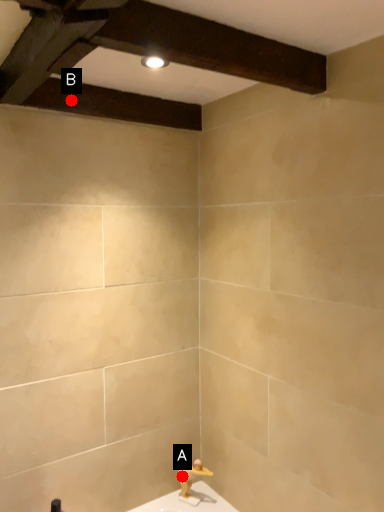
Question: Two points are circled on the image, labeled by A and B beside each circle. Which point is closer to the camera?

Choices:
 (A) A is closer
 (B) B is closer

Answer: (B)